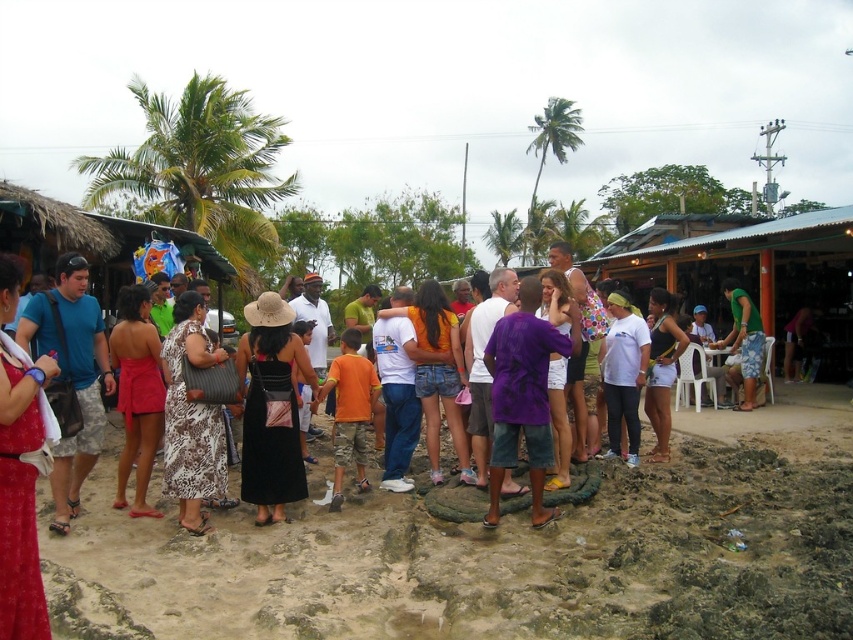
This screenshot has height=640, width=853. I want to click on orange cotton shirt at center, so click(349, 410).

Is orange cotton shirt at center wider than green fabric shirt at right?

Correct, the width of orange cotton shirt at center exceeds that of green fabric shirt at right.

Is point (363, 376) farther from viewer compared to point (727, 340)?

That is False.

Find the location of a particular element. Image resolution: width=853 pixels, height=640 pixels. orange cotton shirt at center is located at coordinates (349, 410).

Does point (64, 460) come closer to viewer compared to point (225, 444)?

Yes, point (64, 460) is closer to viewer.

Which is in front, point (78, 504) or point (177, 316)?

Point (78, 504)

Image resolution: width=853 pixels, height=640 pixels. I want to click on blue camouflage shorts at left, so click(x=71, y=376).

Does point (265, 230) come behind point (279, 436)?

Yes.

Can you confirm if green leafy palm tree at upper left is positioned to the right of black dress at center?

Incorrect, green leafy palm tree at upper left is not on the right side of black dress at center.

Between point (194, 83) and point (292, 497), which one is positioned behind?

Positioned behind is point (194, 83).

Image resolution: width=853 pixels, height=640 pixels. Find the location of `green leafy palm tree at upper left`. green leafy palm tree at upper left is located at coordinates (200, 170).